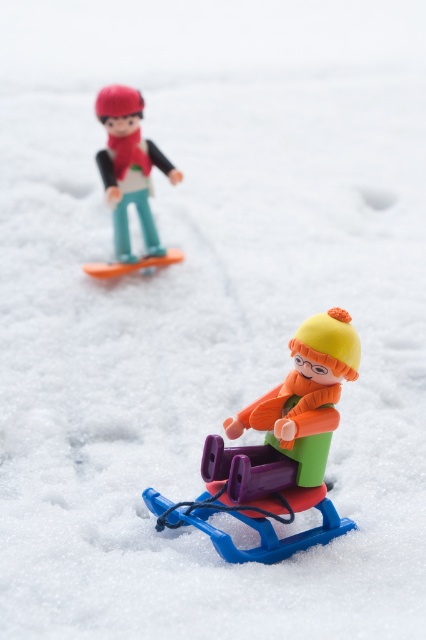
Question: Does matte plastic sled at lower center appear on the right side of matte plastic skier at upper left?

Choices:
 (A) no
 (B) yes

Answer: (B)

Question: Which object appears closest to the camera in this image?

Choices:
 (A) matte plastic sled at lower center
 (B) matte plastic skier at upper left

Answer: (A)

Question: Among these objects, which one is nearest to the camera?

Choices:
 (A) matte plastic skier at upper left
 (B) matte plastic sled at lower center

Answer: (B)

Question: Is matte plastic sled at lower center to the left of matte plastic skier at upper left from the viewer's perspective?

Choices:
 (A) yes
 (B) no

Answer: (B)

Question: Is matte plastic sled at lower center positioned in front of matte plastic skier at upper left?

Choices:
 (A) no
 (B) yes

Answer: (B)